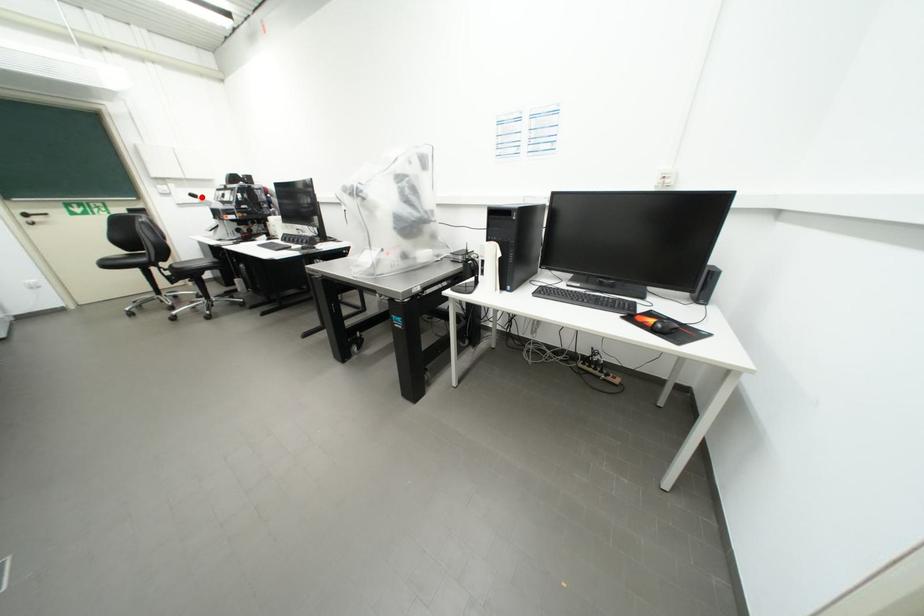
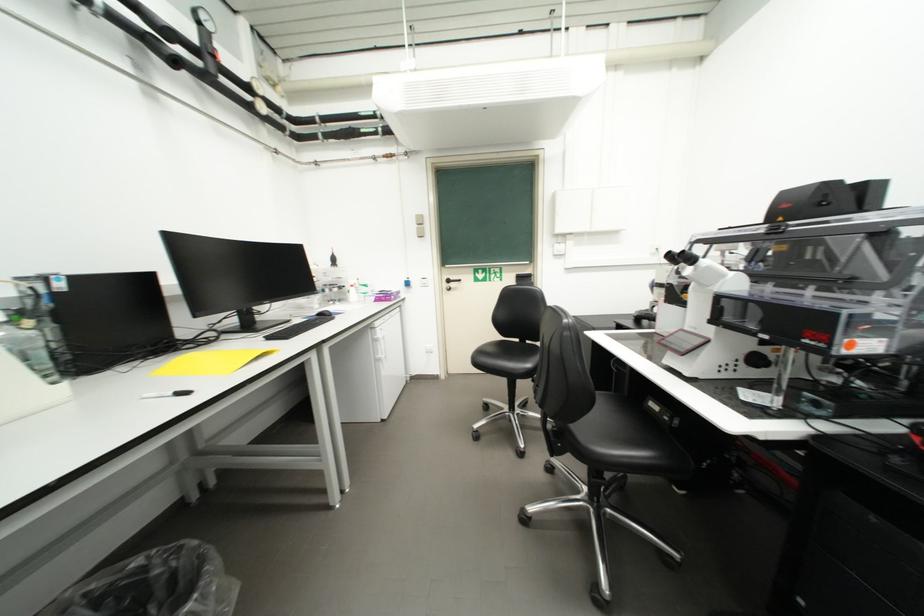
Where in the second image is the point corresponding to the highlighted location from the first image?

(687, 259)